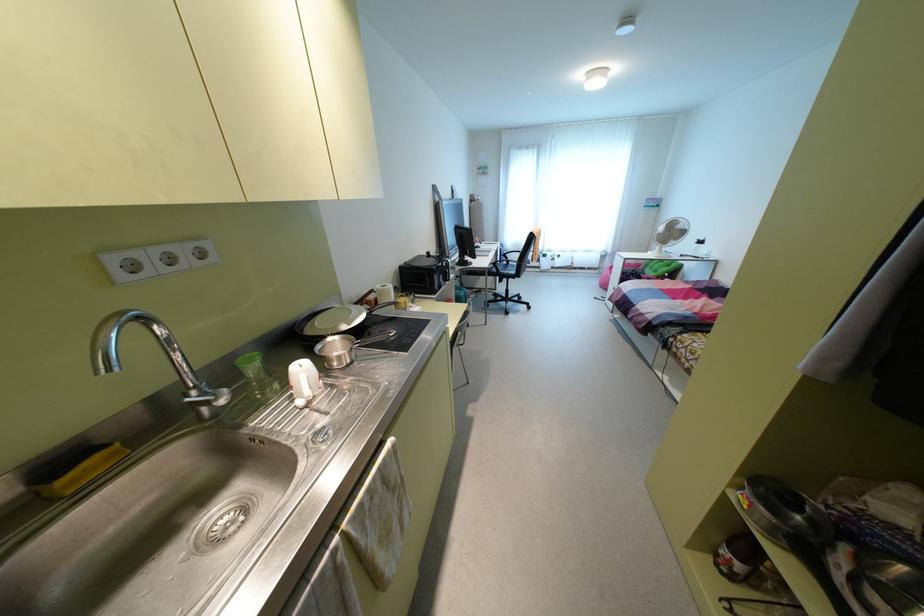
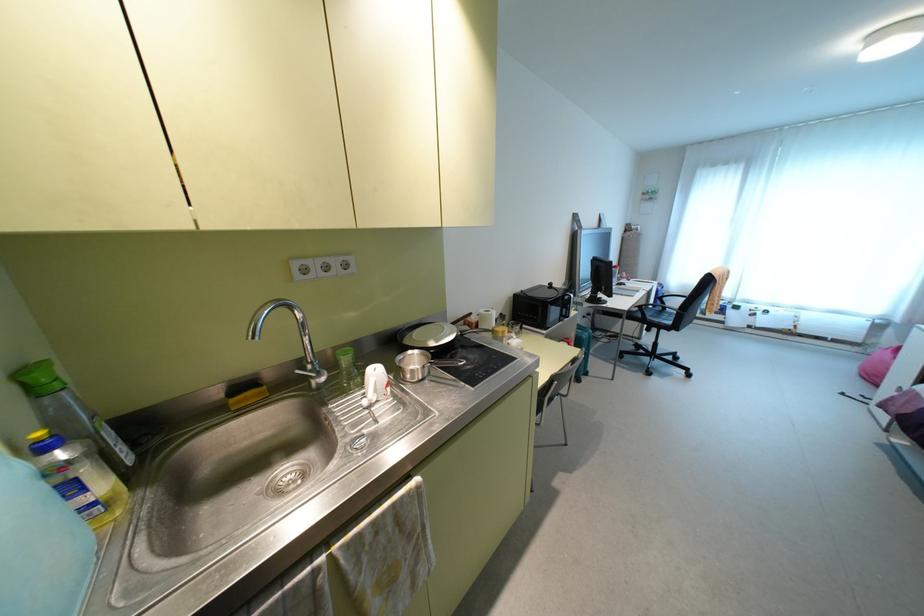
The point at (402, 299) is marked in the first image. Where is the corresponding point in the second image?

(500, 328)